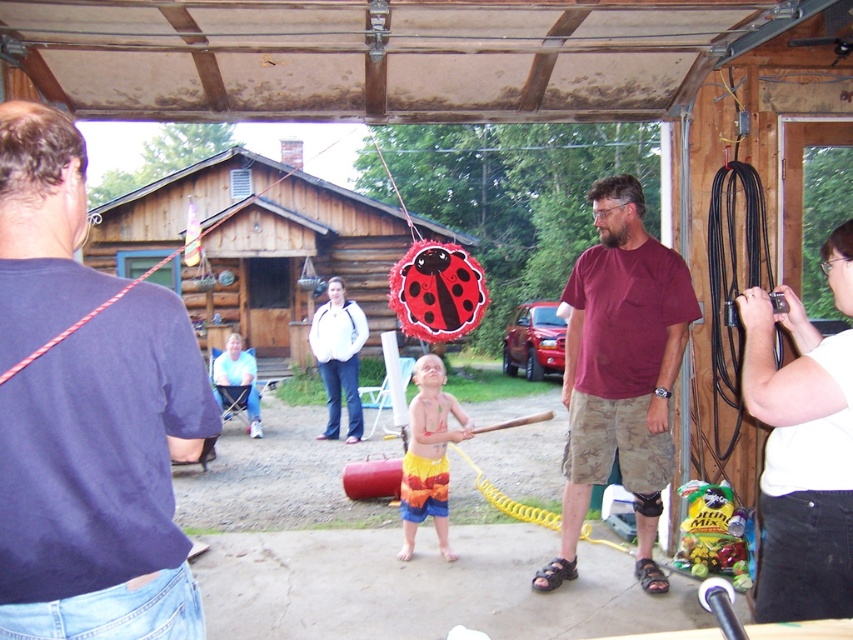
Does maroon cotton shirt at center have a larger size compared to rainbow swim trunks at center?

Correct, maroon cotton shirt at center is larger in size than rainbow swim trunks at center.

Who is more distant from viewer, [631,333] or [439,509]?

The point [439,509] is more distant.

Who is more distant from viewer, (660,433) or (425,365)?

The point (425,365) is more distant.

This screenshot has height=640, width=853. What are the coordinates of `maroon cotton shirt at center` in the screenshot? It's located at (619, 371).

Between dark blue t-shirt at upper left and rainbow swim trunks at center, which one is positioned lower?

rainbow swim trunks at center is lower down.

Is the position of dark blue t-shirt at upper left more distant than that of rainbow swim trunks at center?

No, it is not.

Measure the distance between dark blue t-shirt at upper left and camera.

dark blue t-shirt at upper left is 4.67 feet away from camera.

Where is `dark blue t-shirt at upper left`? Image resolution: width=853 pixels, height=640 pixels. dark blue t-shirt at upper left is located at coordinates (102, 477).

In order to click on dark blue t-shirt at upper left in this screenshot , I will do `click(102, 477)`.

Which of these two, dark blue t-shirt at upper left or maroon cotton shirt at center, stands taller?

Standing taller between the two is maroon cotton shirt at center.

Is point (22, 541) more distant than point (573, 486)?

No.

Image resolution: width=853 pixels, height=640 pixels. I want to click on dark blue t-shirt at upper left, so click(x=102, y=477).